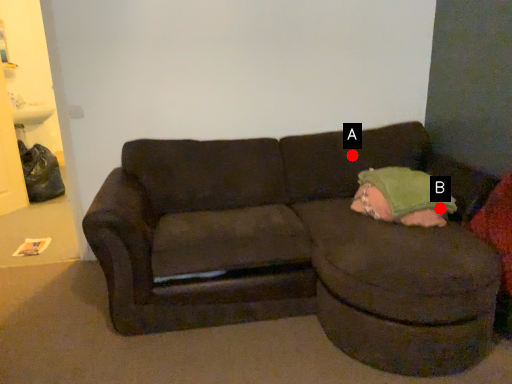
Question: Two points are circled on the image, labeled by A and B beside each circle. Which point is farther to the camera?

Choices:
 (A) A is further
 (B) B is further

Answer: (A)